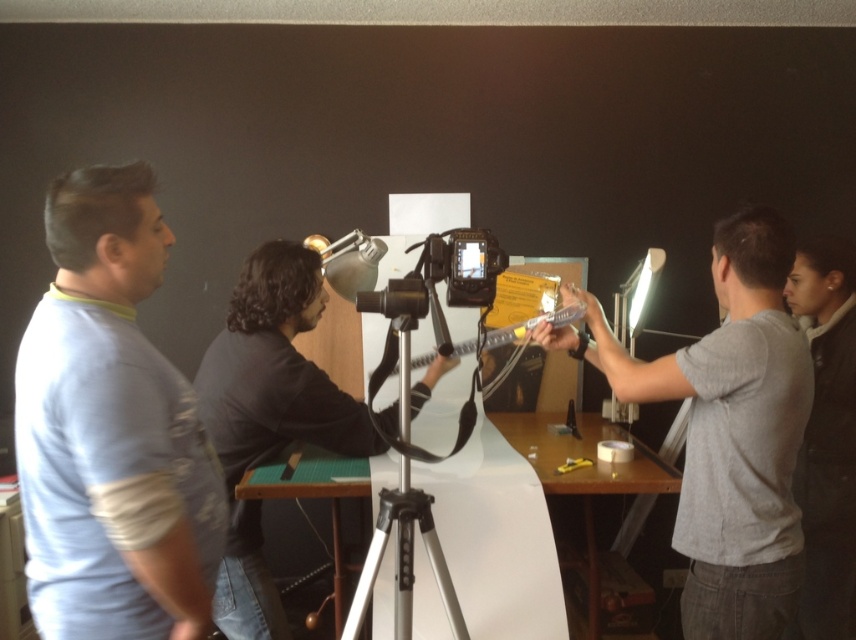
You are a photographer who needs to adjust the lighting between the gray matte shirt at right and the camera. Given that the distance between them is 1.54 meters, what is the minimum length of the extension cord you need to ensure both devices are connected without any gaps?

The gray matte shirt at right and camera are 1.54 meters apart from each other. To ensure both devices are connected without gaps, the extension cord must be at least 1.54 meters long.

You are a costume designer preparing for a photoshoot. You have two shirts available for the model to wear. The gray matte shirt at right and the dark gray fabric shirt at center. Which shirt is narrower in width?

The gray matte shirt at right is narrower in width than the dark gray fabric shirt at center.

You are a photographer standing in front of the camera. You need to adjust the lighting to focus on the person in the light blue cotton shirt at left and the gray matte shirt at right. Which person should you adjust the light closer to first?

The light blue cotton shirt at left is closer to the viewer than the gray matte shirt at right, so you should adjust the light closer to the light blue cotton shirt at left first to ensure proper focus and illumination.